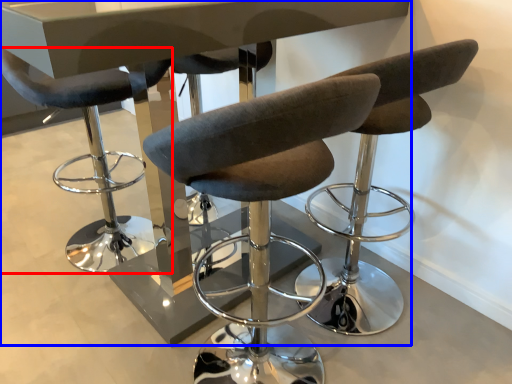
Question: Which of the following is the farthest to the observer, chair (highlighted by a red box) or table (highlighted by a blue box)?

Choices:
 (A) chair
 (B) table

Answer: (A)